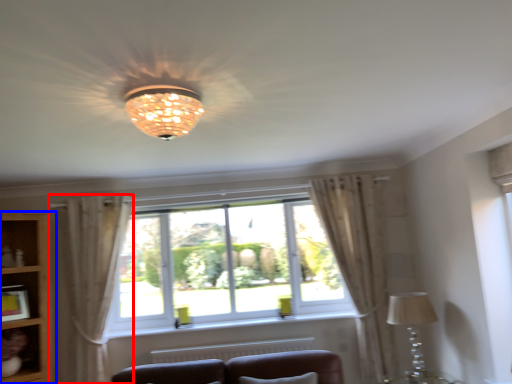
Question: Among these objects, which one is farthest to the camera, curtain (highlighted by a red box) or bookshelf (highlighted by a blue box)?

Choices:
 (A) curtain
 (B) bookshelf

Answer: (A)